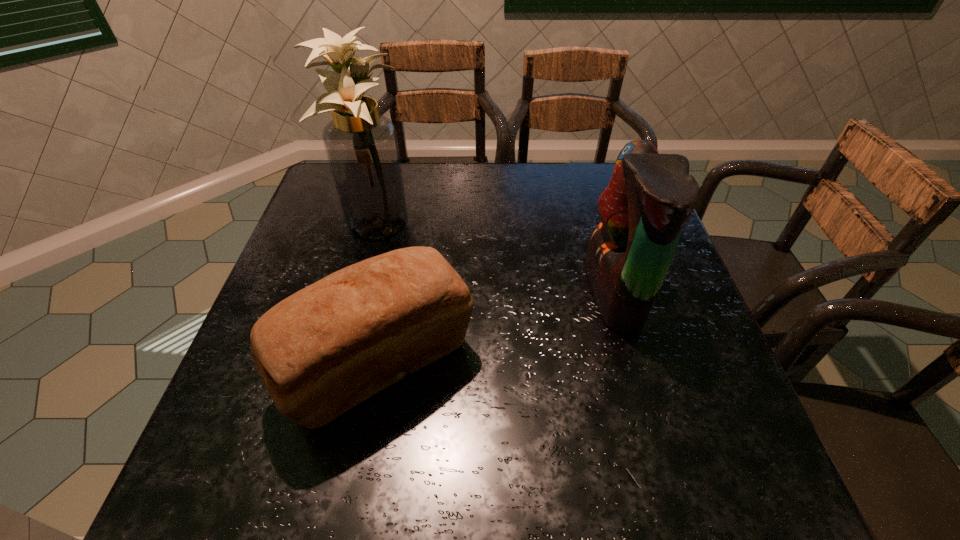
The width and height of the screenshot is (960, 540). Identify the location of free spot between the rightmost object and the shortest object. (497, 329).

You are a GUI agent. You are given a task and a screenshot of the screen. Output one action in this format:
    pyautogui.click(x=<x>, y=<y>)
    Task: Click on the free area in between the tallest object and the parrot
    
    Given the screenshot: What is the action you would take?
    pyautogui.click(x=494, y=258)

Image resolution: width=960 pixels, height=540 pixels. In order to click on free space that is in between the flower arrangement and the second shortest object in this screenshot , I will do `click(494, 258)`.

At what (x,y) coordinates should I click in order to perform the action: click on vacant space in between the second tallest object and the flower arrangement. Please return your answer as a coordinate pair (x, y). The height and width of the screenshot is (540, 960). Looking at the image, I should click on (494, 258).

This screenshot has height=540, width=960. Find the location of `free area in between the second tallest object and the bread`. free area in between the second tallest object and the bread is located at coordinates coord(497,329).

The image size is (960, 540). What are the coordinates of `free space between the flower arrangement and the second shortest object` in the screenshot? It's located at (494, 258).

Locate an element on the screen. The image size is (960, 540). vacant point located between the parrot and the shortest object is located at coordinates (497, 329).

This screenshot has width=960, height=540. Identify the location of free space between the second shortest object and the tallest object. coord(494,258).

In order to click on free space between the flower arrangement and the rightmost object in this screenshot , I will do click(494, 258).

Where is `object identified as the closest to the flower arrangement`? object identified as the closest to the flower arrangement is located at coordinates (328, 347).